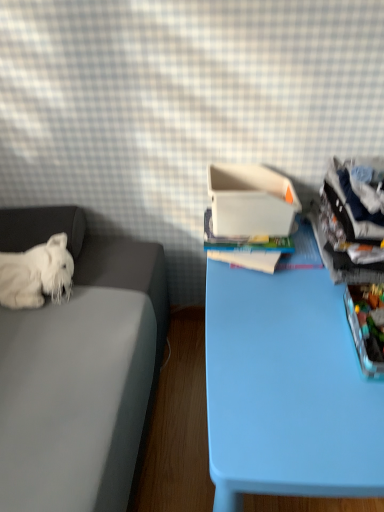
Identify the location of white plastic container at center. This screenshot has width=384, height=512. (250, 201).

Describe the element at coordinates (250, 201) in the screenshot. I see `white plastic container at center` at that location.

You are a GUI agent. You are given a task and a screenshot of the screen. Output one action in this format:
    pyautogui.click(x=<x>, y=<y>)
    Task: Click on the light blue plastic table at center
    The height and width of the screenshot is (512, 384).
    Given the screenshot: What is the action you would take?
    pyautogui.click(x=287, y=390)

Does white plastic container at center lie behind white plush dog at left?

Yes, white plastic container at center is further from the camera.

From the image's perspective, does white plastic container at center appear lower than white plush dog at left?

No, from the image's perspective, white plastic container at center is not below white plush dog at left.

Is white plastic container at center taller or shorter than white plush dog at left?

Clearly, white plastic container at center is taller compared to white plush dog at left.

Would you say white plastic container at center is inside or outside white plush dog at left?

white plastic container at center is spatially situated outside white plush dog at left.

From a real-world perspective, is white plush dog at left above or below translucent plastic storage box at right?

white plush dog at left is situated lower than translucent plastic storage box at right in the real world.

Locate an element on the screen. dog behind the translucent plastic storage box at right is located at coordinates (36, 274).

From the image's perspective, would you say white plush dog at left is positioned over translucent plastic storage box at right?

Yes, from the image's perspective, white plush dog at left is above translucent plastic storage box at right.

Considering the positions of objects white plush dog at left and translucent plastic storage box at right in the image provided, who is behind, white plush dog at left or translucent plastic storage box at right?

white plush dog at left is more distant.

Is light blue plastic table at center completely or partially outside of white plush dog at left?

Yes, light blue plastic table at center is outside of white plush dog at left.

From the image's perspective, between light blue plastic table at center and white plush dog at left, which one is located above?

From the image's view, white plush dog at left is above.

Is the position of light blue plastic table at center more distant than that of white plush dog at left?

That is False.

Is point (304, 418) closer or farther from the camera than point (31, 305)?

Point (304, 418) appears to be closer to the viewer than point (31, 305).

Who is shorter, translucent plastic storage box at right or light blue plastic table at center?

translucent plastic storage box at right.

Could you tell me if translucent plastic storage box at right is turned towards light blue plastic table at center?

No, translucent plastic storage box at right is not facing towards light blue plastic table at center.

Based on the photo, can you confirm if translucent plastic storage box at right is bigger than light blue plastic table at center?

No.

Which object is thinner, translucent plastic storage box at right or white plush dog at left?

With smaller width is white plush dog at left.

From the image's perspective, would you say translucent plastic storage box at right is positioned over white plush dog at left?

No.

Which is correct: light blue plastic table at center is inside translucent plastic storage box at right, or outside of it?

light blue plastic table at center cannot be found inside translucent plastic storage box at right.

Who is smaller, light blue plastic table at center or translucent plastic storage box at right?

Smaller between the two is translucent plastic storage box at right.

Does light blue plastic table at center appear on the left side of translucent plastic storage box at right?

Yes, light blue plastic table at center is to the left of translucent plastic storage box at right.

Between light blue plastic table at center and translucent plastic storage box at right, which one is positioned behind?

translucent plastic storage box at right is further away from the camera.

Relative to light blue plastic table at center, is white plush dog at left in front or behind?

Visually, white plush dog at left is located behind light blue plastic table at center.

Are white plush dog at left and light blue plastic table at center far apart?

No, white plush dog at left is not far away from light blue plastic table at center.

Between white plush dog at left and light blue plastic table at center, which one has smaller width?

Thinner between the two is white plush dog at left.

From a real-world perspective, is white plush dog at left physically below light blue plastic table at center?

Actually, white plush dog at left is physically above light blue plastic table at center in the real world.

At what (x,y) coordinates should I click in order to perform the action: click on dog on the left of white plastic container at center. Please return your answer as a coordinate pair (x, y). The width and height of the screenshot is (384, 512). Looking at the image, I should click on (36, 274).

Identify the location of storage box on the right of white plush dog at left. (367, 325).

Which object lies nearer to the anchor point light blue plastic table at center, white plastic container at center or translucent plastic storage box at right?

Based on the image, translucent plastic storage box at right appears to be nearer to light blue plastic table at center.

Considering their positions, is white plush dog at left positioned closer to white plastic container at center than light blue plastic table at center?

light blue plastic table at center is positioned closer to the anchor white plastic container at center.

From the image, which object appears to be farther from white plastic container at center, translucent plastic storage box at right or light blue plastic table at center?

Based on the image, translucent plastic storage box at right appears to be further to white plastic container at center.

From the image, which object appears to be farther from white plastic container at center, white plush dog at left or translucent plastic storage box at right?

The object further to white plastic container at center is white plush dog at left.

Considering their positions, is white plastic container at center positioned closer to translucent plastic storage box at right than light blue plastic table at center?

light blue plastic table at center.

When comparing their distances from translucent plastic storage box at right, does white plastic container at center or white plush dog at left seem further?

white plush dog at left is further to translucent plastic storage box at right.

Which object lies nearer to the anchor point light blue plastic table at center, translucent plastic storage box at right or white plastic container at center?

translucent plastic storage box at right is closer to light blue plastic table at center.

When comparing their distances from translucent plastic storage box at right, does light blue plastic table at center or white plastic container at center seem closer?

Among the two, light blue plastic table at center is located nearer to translucent plastic storage box at right.

Locate an element on the screen. The height and width of the screenshot is (512, 384). table situated between white plush dog at left and translucent plastic storage box at right from left to right is located at coordinates (287, 390).

At what (x,y) coordinates should I click in order to perform the action: click on storage box between white plastic container at center and light blue plastic table at center vertically. Please return your answer as a coordinate pair (x, y). The height and width of the screenshot is (512, 384). Looking at the image, I should click on [x=367, y=325].

The image size is (384, 512). Find the location of `cardboard box between white plush dog at left and light blue plastic table at center`. cardboard box between white plush dog at left and light blue plastic table at center is located at coordinates (250, 201).

Identify the location of cardboard box between white plush dog at left and translucent plastic storage box at right from left to right. The image size is (384, 512). (250, 201).